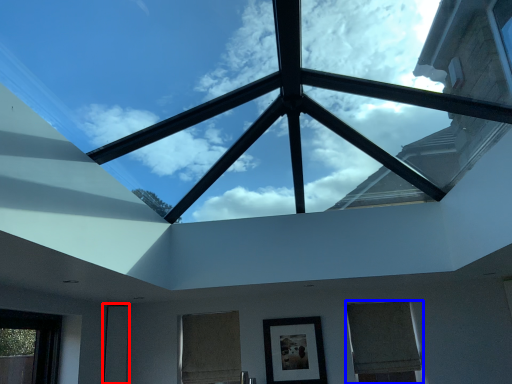
Question: Which of the following is the farthest to the observer, glass door (highlighted by a red box) or window (highlighted by a blue box)?

Choices:
 (A) glass door
 (B) window

Answer: (A)